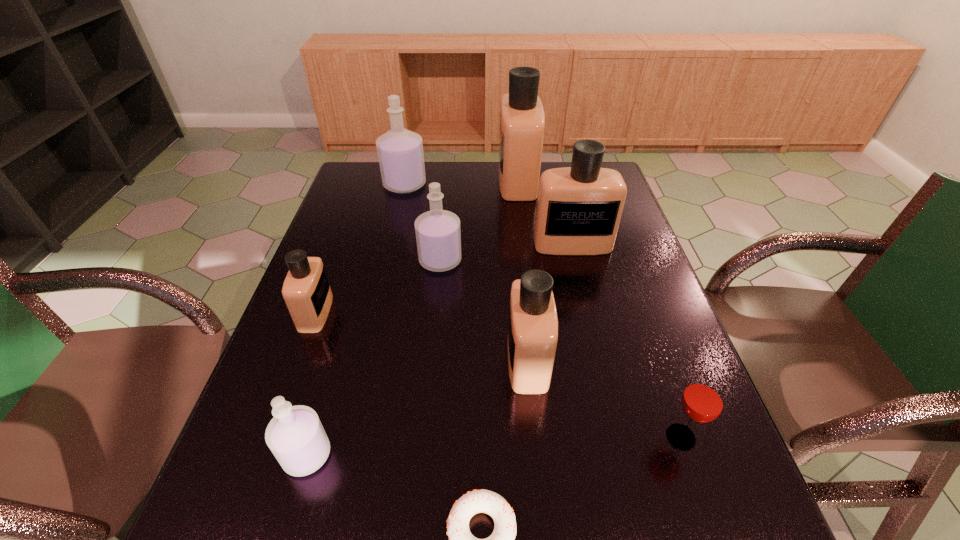
Image resolution: width=960 pixels, height=540 pixels. In order to click on free space between the third biggest beige perfume and the farthest beige perfume in this screenshot , I will do `click(522, 271)`.

Where is `free space between the tallest perfume and the smallest purple perfume`? Image resolution: width=960 pixels, height=540 pixels. free space between the tallest perfume and the smallest purple perfume is located at coordinates (412, 318).

The width and height of the screenshot is (960, 540). What are the coordinates of `vacant space that's between the smallest beige perfume and the second smallest beige perfume` in the screenshot? It's located at (421, 336).

This screenshot has height=540, width=960. I want to click on free point between the biggest purple perfume and the tallest object, so click(461, 183).

Where is `object that is the third closest to the biggest purple perfume`? object that is the third closest to the biggest purple perfume is located at coordinates (579, 208).

Where is `object that is the sixth closest to the smallest beige perfume`? Image resolution: width=960 pixels, height=540 pixels. object that is the sixth closest to the smallest beige perfume is located at coordinates (579, 208).

The image size is (960, 540). Find the location of `perfume identified as the closest to the nearest perfume`. perfume identified as the closest to the nearest perfume is located at coordinates (306, 290).

Locate which perfume ranks third in proximity to the farthest purple perfume. Please provide its 2D coordinates. Your answer should be formatted as a tuple, i.e. [(x, y)], where the tuple contains the x and y coordinates of a point satisfying the conditions above.

[(579, 208)]

Identify which beige perfume is the closest to the red glass. Please provide its 2D coordinates. Your answer should be formatted as a tuple, i.e. [(x, y)], where the tuple contains the x and y coordinates of a point satisfying the conditions above.

[(532, 340)]

The width and height of the screenshot is (960, 540). Identify the location of the closest beige perfume to the leftmost object. (532, 340).